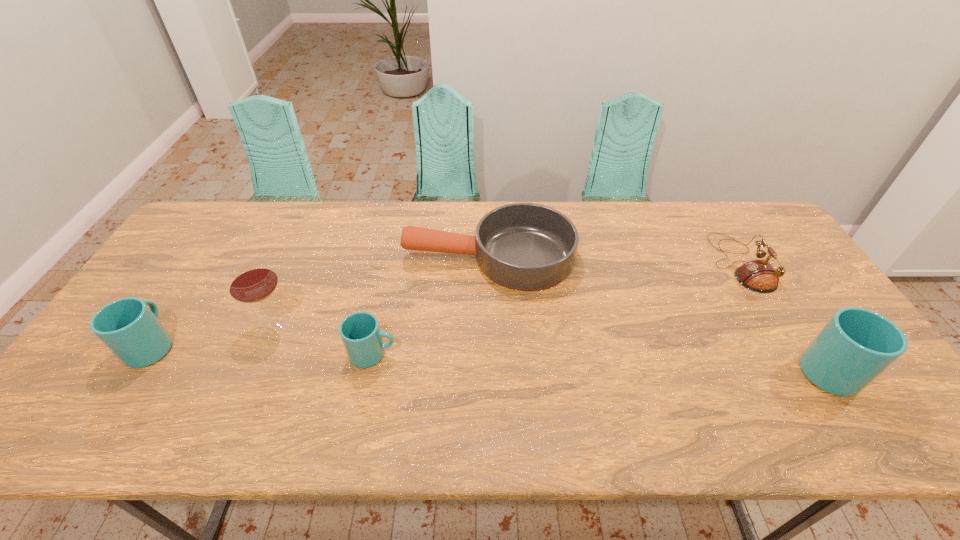
The image size is (960, 540). Find the location of `free region at the far right corner of the desktop`. free region at the far right corner of the desktop is located at coordinates [773, 242].

At what (x,y) coordinates should I click in order to perform the action: click on vacant point located between the pan and the fifth object from right to left. Please return your answer as a coordinate pair (x, y). The width and height of the screenshot is (960, 540). Looking at the image, I should click on (381, 292).

Identify the location of unoccupied area between the telephone and the tallest cup. (789, 319).

This screenshot has height=540, width=960. I want to click on vacant space that's between the pan and the leftmost object, so click(321, 301).

Identify the location of blank region between the shortest cup and the telephone. (556, 309).

Identify the location of vacant region between the fifth object from right to left and the fourth shortest object. This screenshot has width=960, height=540. (213, 335).

Find the location of a particular element. This screenshot has height=540, width=960. empty location between the second shortest cup and the telephone is located at coordinates (446, 304).

Image resolution: width=960 pixels, height=540 pixels. Find the location of `free spot between the shortest cup and the wineglass`. free spot between the shortest cup and the wineglass is located at coordinates (324, 340).

Identify the location of vacant point located between the pan and the telephone. (614, 261).

Locate an element on the screen. blank region between the second object from left to right and the rightmost cup is located at coordinates [556, 349].